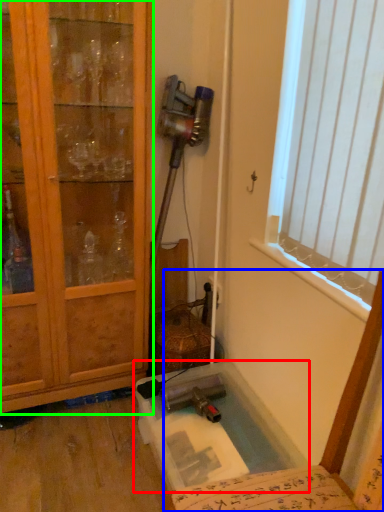
Question: Estimate the real-world distances between objects in this image. Which object is closer to bath (highlighted by a red box), chair (highlighted by a blue box) or cabinetry (highlighted by a green box)?

Choices:
 (A) chair
 (B) cabinetry

Answer: (A)